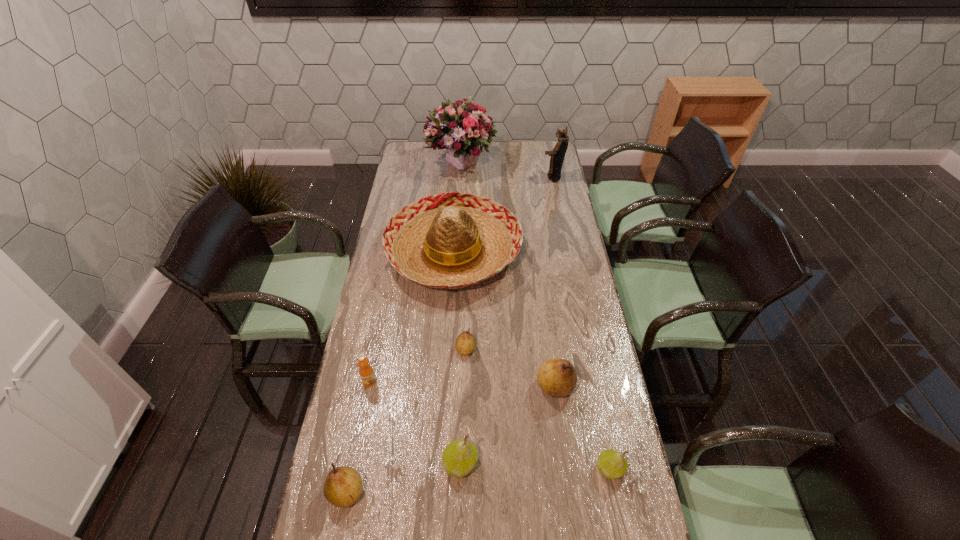
What are the coordinates of `bouquet` in the screenshot? It's located at (460, 127).

The image size is (960, 540). In order to click on the second tallest object in this screenshot , I will do `click(558, 153)`.

Find the location of a particular element. sombrero is located at coordinates (452, 240).

Locate an element on the screen. The image size is (960, 540). red sombrero is located at coordinates (452, 240).

This screenshot has height=540, width=960. Find the location of `the seventh object from left to right`. the seventh object from left to right is located at coordinates (557, 377).

Identify the location of the fourth pear from left to right. (557, 377).

Where is `the left green pear`? Image resolution: width=960 pixels, height=540 pixels. the left green pear is located at coordinates (459, 458).

Locate an element on the screen. The width and height of the screenshot is (960, 540). orange juice is located at coordinates (366, 372).

Locate an element on the screen. The width and height of the screenshot is (960, 540). the leftmost pear is located at coordinates (343, 486).

Where is `the leftmost brown pear`? the leftmost brown pear is located at coordinates (343, 486).